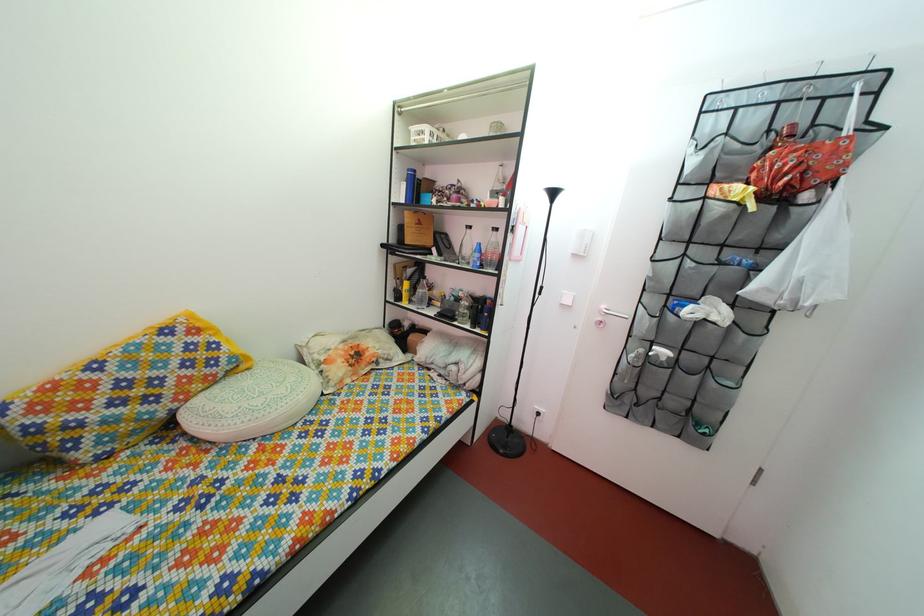
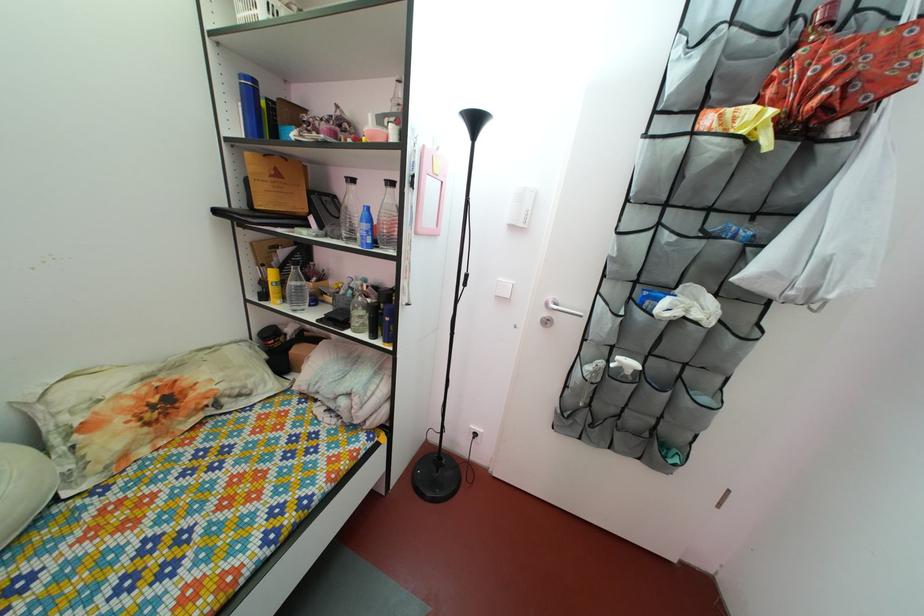
Locate, in the second image, the point that corresponds to the point at 478,272 in the first image.

(363, 248)